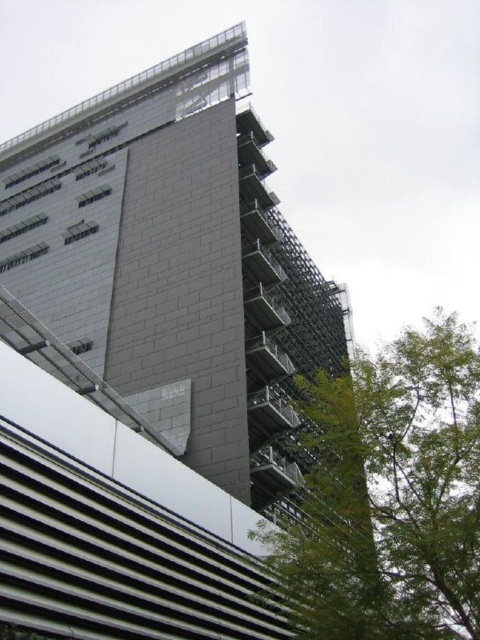
You are standing in front of the gray concrete building at upper center and notice a green leafy tree at lower right. Which object is closer to you based on their positions?

The gray concrete building at upper center is closer to you than the green leafy tree at lower right because the tree is positioned behind the building.

You are standing at the origin point in a coordinate system where the image is mapped to a grid from 0 to 1 in both x and y directions. You need to locate the gray concrete building at upper center. What are its coordinates?

The gray concrete building at upper center is located at coordinates point (172, 266).

You are standing at the entrance of the building and see the point marked as point (x=172, y=266). Based on the description, what does this point represent?

The point (x=172, y=266) represents the location of the gray concrete building at upper center.